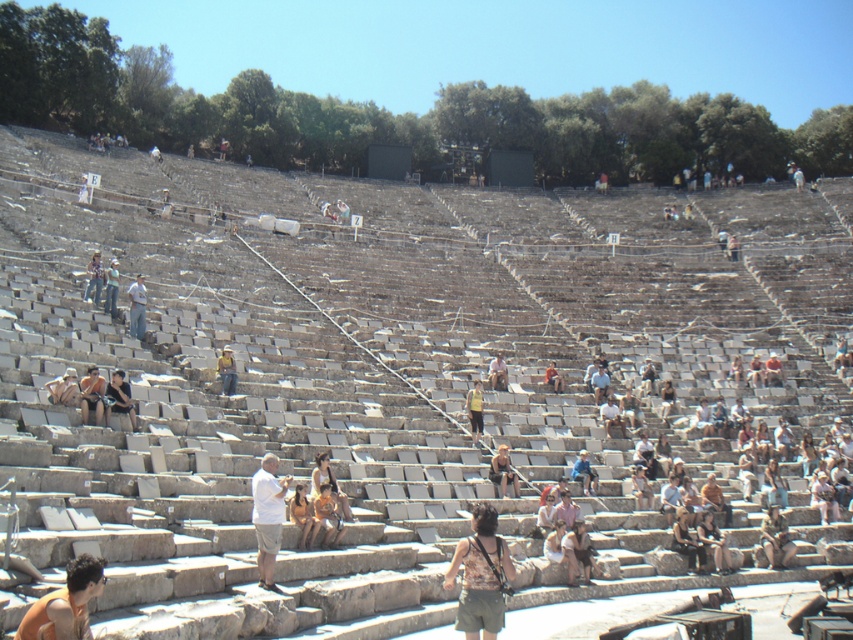
Consider the image. You are a photographer standing at the back of the Epidaurus Theater. You see a yellow fabric person at center and a denim shorts at center. Which one do you think is more likely to be visible from your position? Explain your reasoning.

The yellow fabric person at center is more likely to be visible because they are wearing a brighter color, making them stand out against the stone seating. Additionally, the denim shorts at center might blend in more with the surroundings due to their darker color.

You are standing at the front of the Epidaurus Theater and see two points marked in the image. Which point, point (131, 312) or point (221, 349), is closer to you?

Point (131, 312) is closer to you than point (221, 349).

You are standing at the center of the Epidaurus Theater and want to take a photo of two specific points marked in the image. The first point is at coordinates point (234,369) and the second is at point (117,285). Which point will appear larger in your photo?

Point (234,369) is closer to the camera than point (117,285), so it will appear larger in the photo.